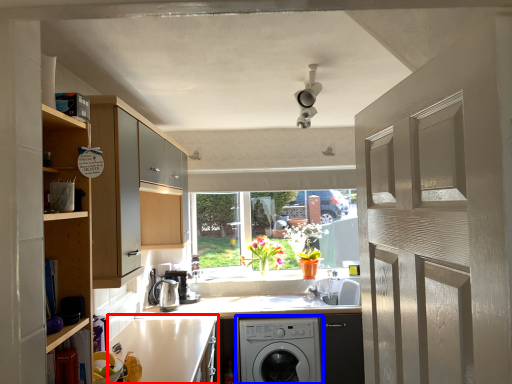
Question: Which of the following is the closest to the observer, counter top (highlighted by a red box) or washing machine (highlighted by a blue box)?

Choices:
 (A) counter top
 (B) washing machine

Answer: (A)